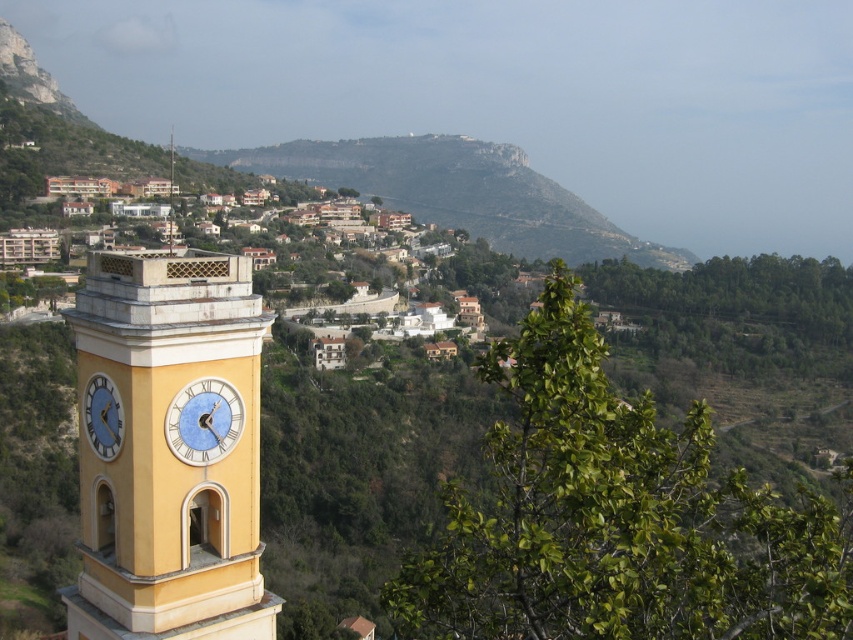
You are standing in the hillside town and want to take a photo of the blue glass clock at center. Where should you position yourself to capture it in the frame?

To capture the blue glass clock at center in your photo, position yourself at the point corresponding to the coordinates provided in the scene description.

You are standing in the town square and notice a point marked at coordinates (x=171, y=449). Based on the scene description, which object is this point most likely located on?

The point at coordinates (x=171, y=449) is on the yellow painted stone clock tower at left.

You are standing in the town square and want to take a photo of the yellow painted stone clock tower at left and the green rocky mountain at upper center. Which object should you frame first in your camera to ensure both are in the shot?

You should frame the yellow painted stone clock tower at left first since it is positioned to the left of the green rocky mountain at upper center, allowing both to be captured in the same frame when adjusting the camera angle accordingly.